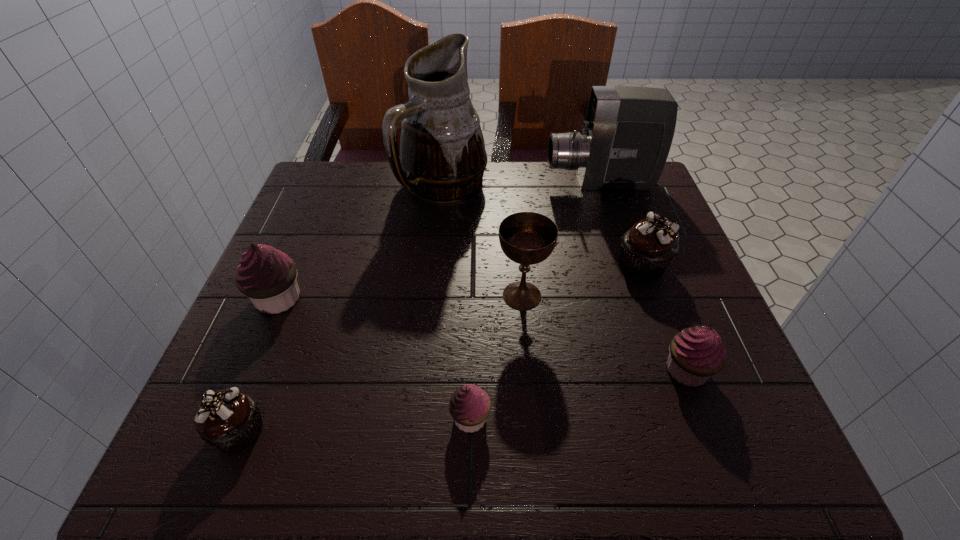
The height and width of the screenshot is (540, 960). I want to click on free area in between the brown pitcher and the camcorder, so click(x=522, y=185).

Identify the location of empty space that is in between the fifth shortest object and the third cupcake from left to right. (374, 358).

Find the location of `free space that is in between the smaller brown cupcake and the biggest pink cupcake`. free space that is in between the smaller brown cupcake and the biggest pink cupcake is located at coordinates 258,364.

In order to click on empty space that is in between the fourth object from right to left and the second pink cupcake from left to right in this screenshot , I will do `click(496, 356)`.

This screenshot has width=960, height=540. I want to click on the fifth closest object to the farthest pink cupcake, so click(x=626, y=137).

Where is `object that can be found as the fifth closest to the camcorder`? The image size is (960, 540). object that can be found as the fifth closest to the camcorder is located at coordinates (x=469, y=406).

Identify which cupcake is the nearest to the left brown cupcake. Please provide its 2D coordinates. Your answer should be formatted as a tuple, i.e. [(x, y)], where the tuple contains the x and y coordinates of a point satisfying the conditions above.

[(267, 276)]

The width and height of the screenshot is (960, 540). In order to click on cupcake object that ranks as the second closest to the fourth object from right to left in this screenshot , I will do `click(469, 406)`.

Locate an element on the screen. This screenshot has height=540, width=960. the third closest pink cupcake to the fourth object from right to left is located at coordinates (267, 276).

Identify which pink cupcake is located as the second nearest to the right brown cupcake. Please provide its 2D coordinates. Your answer should be formatted as a tuple, i.e. [(x, y)], where the tuple contains the x and y coordinates of a point satisfying the conditions above.

[(469, 406)]